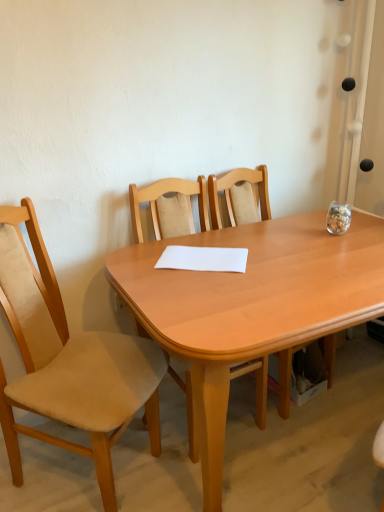
This screenshot has height=512, width=384. I want to click on light wood chair at center, placed as the 2th chair when sorted from left to right, so click(169, 207).

Image resolution: width=384 pixels, height=512 pixels. What are the coordinates of `white paper at center` in the screenshot? It's located at (203, 259).

Does wooden chair at center, which is the 3th chair from left to right, have a lesser height compared to white paper at center?

No.

Is wooden chair at center, which is the 3th chair from left to right, placed right next to white paper at center?

No, wooden chair at center, which is the 3th chair from left to right, is not making contact with white paper at center.

Can you confirm if wooden chair at center, which is the 3th chair from left to right, is smaller than white paper at center?

No.

Does point (316, 346) lie behind point (169, 256)?

Yes, it is.

Is white paper at center closer to the viewer compared to beige fabric chair at left, placed as the third chair when sorted from right to left?

No, it is behind beige fabric chair at left, placed as the third chair when sorted from right to left.

From a real-world perspective, is white paper at center positioned above or below beige fabric chair at left, placed as the third chair when sorted from right to left?

Clearly, from a real-world perspective, white paper at center is above beige fabric chair at left, placed as the third chair when sorted from right to left.

Is white paper at center positioned far away from beige fabric chair at left, placed as the third chair when sorted from right to left?

No, white paper at center is in close proximity to beige fabric chair at left, placed as the third chair when sorted from right to left.

From a real-world perspective, who is located lower, white paper at center or wooden chair at center, the first chair in the right-to-left sequence?

wooden chair at center, the first chair in the right-to-left sequence.

From the image's perspective, is white paper at center under wooden chair at center, the first chair in the right-to-left sequence?

No, from the image's perspective, white paper at center is not below wooden chair at center, the first chair in the right-to-left sequence.

Is white paper at center smaller than wooden chair at center, the first chair in the right-to-left sequence?

Yes, white paper at center is smaller than wooden chair at center, the first chair in the right-to-left sequence.

Considering the sizes of objects wooden chair at center, the first chair in the right-to-left sequence, and light wood chair at center, placed as the 2th chair when sorted from left to right, in the image provided, who is shorter, wooden chair at center, the first chair in the right-to-left sequence, or light wood chair at center, placed as the 2th chair when sorted from left to right,?

With less height is wooden chair at center, the first chair in the right-to-left sequence.

Where is `chair behind the light wood chair at center, which is the second chair from right to left`? Image resolution: width=384 pixels, height=512 pixels. chair behind the light wood chair at center, which is the second chair from right to left is located at coordinates (303, 371).

Is wooden chair at center, the first chair in the right-to-left sequence, in contact with light wood chair at center, which is the second chair from right to left?

wooden chair at center, the first chair in the right-to-left sequence, is not next to light wood chair at center, which is the second chair from right to left, and they're not touching.

From a real-world perspective, between wooden chair at center, which is the 3th chair from left to right, and light wood chair at center, placed as the 2th chair when sorted from left to right, who is vertically higher?

From a 3D spatial view, light wood chair at center, placed as the 2th chair when sorted from left to right, is above.

From a real-world perspective, starting from the light wood table at center, which chair is the 2nd one vertically above it? Please provide its 2D coordinates.

[(68, 361)]

Is light wood table at center oriented away from beige fabric chair at left, the first chair when ordered from left to right?

That's not correct — light wood table at center is not looking away from beige fabric chair at left, the first chair when ordered from left to right.

Is light wood table at center in front of or behind beige fabric chair at left, placed as the third chair when sorted from right to left, in the image?

In the image, light wood table at center appears in front of beige fabric chair at left, placed as the third chair when sorted from right to left.

Who is smaller, light wood table at center or beige fabric chair at left, the first chair when ordered from left to right?

With smaller size is beige fabric chair at left, the first chair when ordered from left to right.

Can you confirm if wooden chair at center, which is the 3th chair from left to right, is shorter than light wood table at center?

Incorrect, the height of wooden chair at center, which is the 3th chair from left to right, does not fall short of that of light wood table at center.

Is wooden chair at center, which is the 3th chair from left to right, wider or thinner than light wood table at center?

Clearly, wooden chair at center, which is the 3th chair from left to right, has less width compared to light wood table at center.

Can you confirm if wooden chair at center, which is the 3th chair from left to right, is positioned to the left of light wood table at center?

Yes.

Measure the distance between wooden chair at center, the first chair in the right-to-left sequence, and light wood table at center.

wooden chair at center, the first chair in the right-to-left sequence, and light wood table at center are 62.83 centimeters apart.

Consider the image. Is light wood chair at center, which is the second chair from right to left, positioned far away from light wood table at center?

light wood chair at center, which is the second chair from right to left, is actually quite close to light wood table at center.

Could you tell me if light wood chair at center, placed as the 2th chair when sorted from left to right, is turned towards light wood table at center?

Yes, light wood chair at center, placed as the 2th chair when sorted from left to right, is turned towards light wood table at center.

From the image's perspective, is light wood chair at center, placed as the 2th chair when sorted from left to right, positioned above or below light wood table at center?

From the image's perspective, light wood chair at center, placed as the 2th chair when sorted from left to right, appears above light wood table at center.

From a real-world perspective, between light wood chair at center, placed as the 2th chair when sorted from left to right, and light wood table at center, who is vertically lower?

light wood table at center.

Locate an element on the screen. This screenshot has width=384, height=512. notepad positioned vertically above the wooden chair at center, the first chair in the right-to-left sequence (from a real-world perspective) is located at coordinates (203, 259).

There is a white paper at center. Where is `the 2nd chair below it (from a real-world perspective)`? the 2nd chair below it (from a real-world perspective) is located at coordinates (68, 361).

Based on their spatial positions, is beige fabric chair at left, placed as the third chair when sorted from right to left, or wooden chair at center, the first chair in the right-to-left sequence, closer to light wood table at center?

The object closer to light wood table at center is beige fabric chair at left, placed as the third chair when sorted from right to left.

Considering their positions, is wooden chair at center, which is the 3th chair from left to right, positioned further to white paper at center than light wood chair at center, placed as the 2th chair when sorted from left to right?

wooden chair at center, which is the 3th chair from left to right, lies further to white paper at center than the other object.

Estimate the real-world distances between objects in this image. Which object is further from beige fabric chair at left, placed as the third chair when sorted from right to left, wooden chair at center, the first chair in the right-to-left sequence, or light wood table at center?

wooden chair at center, the first chair in the right-to-left sequence, is positioned further to the anchor beige fabric chair at left, placed as the third chair when sorted from right to left.

Estimate the real-world distances between objects in this image. Which object is further from white paper at center, wooden chair at center, the first chair in the right-to-left sequence, or light wood table at center?

wooden chair at center, the first chair in the right-to-left sequence, lies further to white paper at center than the other object.

Based on their spatial positions, is light wood table at center or light wood chair at center, which is the second chair from right to left, closer to wooden chair at center, which is the 3th chair from left to right?

The object closer to wooden chair at center, which is the 3th chair from left to right, is light wood chair at center, which is the second chair from right to left.

Looking at the image, which one is located further to beige fabric chair at left, placed as the third chair when sorted from right to left, light wood chair at center, which is the second chair from right to left, or white paper at center?

light wood chair at center, which is the second chair from right to left, is positioned further to the anchor beige fabric chair at left, placed as the third chair when sorted from right to left.

Which object lies nearer to the anchor point light wood table at center, light wood chair at center, which is the second chair from right to left, or wooden chair at center, the first chair in the right-to-left sequence?

light wood chair at center, which is the second chair from right to left.

Based on their spatial positions, is light wood chair at center, which is the second chair from right to left, or beige fabric chair at left, the first chair when ordered from left to right, further from light wood table at center?

light wood chair at center, which is the second chair from right to left, is positioned further to the anchor light wood table at center.

Find the location of a particular element. Image resolution: width=384 pixels, height=512 pixels. notepad situated between beige fabric chair at left, the first chair when ordered from left to right, and wooden chair at center, which is the 3th chair from left to right, from left to right is located at coordinates (203, 259).

You are a GUI agent. You are given a task and a screenshot of the screen. Output one action in this format:
    pyautogui.click(x=<x>, y=<y>)
    Task: Click on the notepad located between light wood table at center and wooden chair at center, which is the 3th chair from left to right, in the depth direction
    This screenshot has height=512, width=384.
    Given the screenshot: What is the action you would take?
    pyautogui.click(x=203, y=259)

At what (x,y) coordinates should I click in order to perform the action: click on chair between beige fabric chair at left, placed as the third chair when sorted from right to left, and white paper at center from left to right. Please return your answer as a coordinate pair (x, y). Looking at the image, I should click on (169, 207).

Identify the location of notepad between light wood chair at center, placed as the 2th chair when sorted from left to right, and wooden chair at center, which is the 3th chair from left to right. (203, 259).